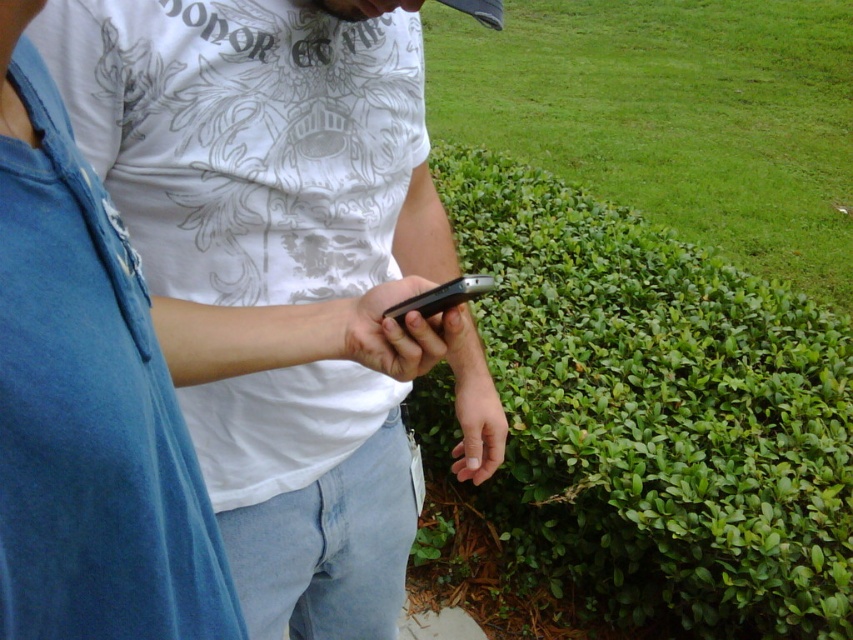
Does point (541, 492) come in front of point (473, 280)?

No, (541, 492) is further to viewer.

Can you confirm if green leafy bush at center is wider than black matte smartphone at center?

Yes.

Who is more distant from viewer, (535,570) or (447,292)?

Positioned behind is point (535,570).

You are a GUI agent. You are given a task and a screenshot of the screen. Output one action in this format:
    pyautogui.click(x=<x>, y=<y>)
    Task: Click on the green leafy bush at center
    The image size is (853, 640).
    Given the screenshot: What is the action you would take?
    pyautogui.click(x=656, y=416)

Which is in front, point (129, 52) or point (439, 289)?

Point (439, 289)

Can you confirm if matte white shirt at center is positioned above black matte smartphone at center?

No.

Between point (218, 166) and point (412, 300), which one is positioned behind?

Point (218, 166)

Identify the location of matte white shirt at center. (271, 262).

Which is above, matte white shirt at center or green leafy bush at center?

green leafy bush at center is higher up.

Identify the location of matte white shirt at center. This screenshot has height=640, width=853. (x=271, y=262).